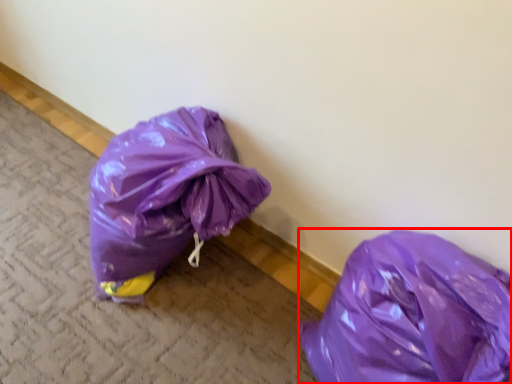
Question: From the image's perspective, considering the relative positions of plastic bag (annotated by the red box) and pavement in the image provided, where is plastic bag (annotated by the red box) located with respect to the staircase?

Choices:
 (A) above
 (B) below

Answer: (B)